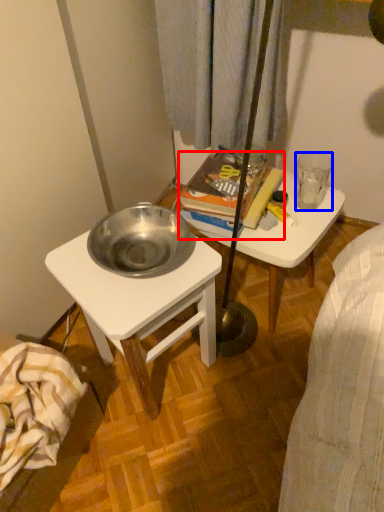
Question: Which of the following is the closest to the observer, book (highlighted by a red box) or coffee cup (highlighted by a blue box)?

Choices:
 (A) book
 (B) coffee cup

Answer: (A)